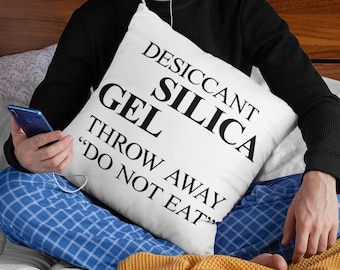
This screenshot has width=340, height=270. Identify the location of phone. (39, 124).